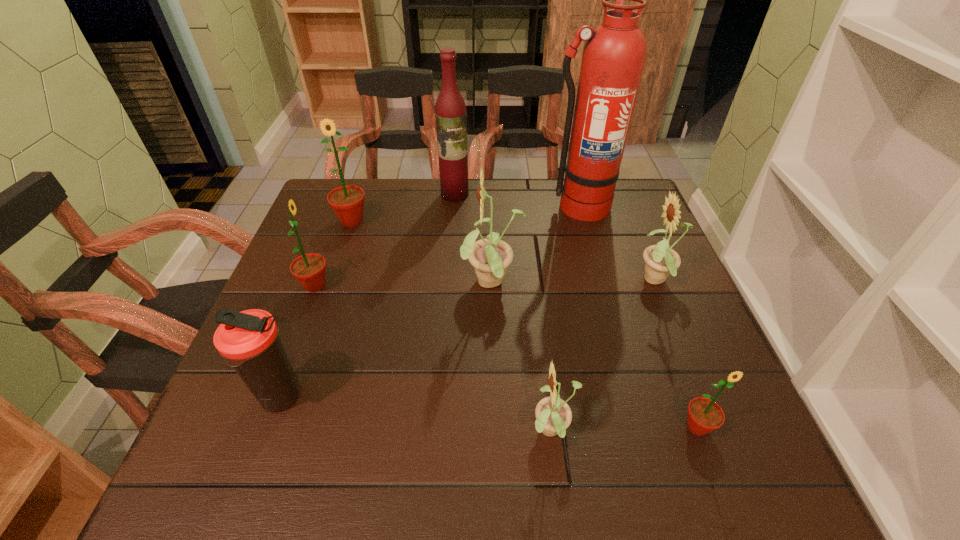
Find the location of a particular element. thermos bottle that is at the left edge is located at coordinates (248, 340).

Locate an element on the screen. The height and width of the screenshot is (540, 960). fire extinguisher present at the right edge is located at coordinates [614, 55].

The image size is (960, 540). Identify the location of object at the far left corner. [347, 202].

At what (x,y) coordinates should I click in order to perform the action: click on object that is at the far right corner. Please return your answer as a coordinate pair (x, y). This screenshot has width=960, height=540. Looking at the image, I should click on (614, 55).

Identify the location of object located at the near right corner. The height and width of the screenshot is (540, 960). (x=704, y=415).

The image size is (960, 540). Identify the location of vacant position at the far edge of the desktop. (441, 201).

Locate an element on the screen. vacant space at the near edge of the desktop is located at coordinates (394, 480).

You are a GUI agent. You are given a task and a screenshot of the screen. Output one action in this format:
    pyautogui.click(x=<x>, y=<y>)
    Task: Click on the free region at the left edge of the desktop
    
    Given the screenshot: What is the action you would take?
    pyautogui.click(x=310, y=334)

Where is `blank space at the right edge`? blank space at the right edge is located at coordinates (735, 431).

At what (x,y) coordinates should I click in order to perform the action: click on free spot at the far right corner of the desktop. Please return your answer as a coordinate pair (x, y). The height and width of the screenshot is (540, 960). Looking at the image, I should click on (638, 217).